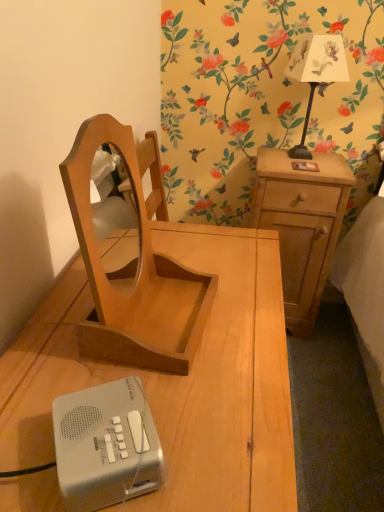
Identify the location of vacant space behind light brown wood mirror at center. The width and height of the screenshot is (384, 512). (192, 260).